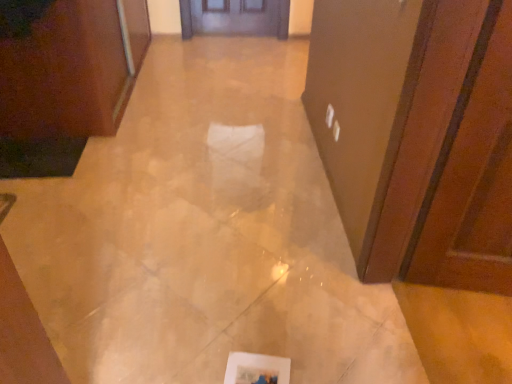
What do you see at coordinates (472, 177) in the screenshot? I see `wooden door at right` at bounding box center [472, 177].

Measure the distance between wooden door at right and camera.

wooden door at right and camera are 1.08 meters apart.

This screenshot has height=384, width=512. I want to click on wooden door at right, so click(x=472, y=177).

This screenshot has height=384, width=512. Identify the location of wooden door at right. (472, 177).